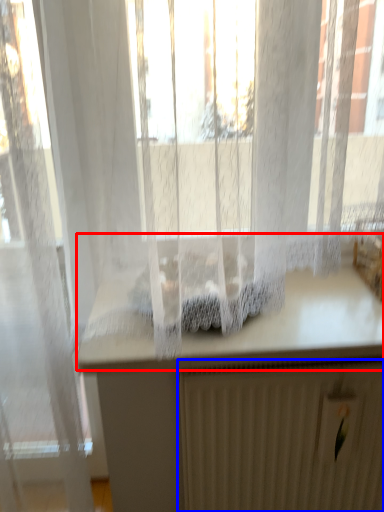
Question: Which object is further to the camera taking this photo, counter top (highlighted by a red box) or radiator (highlighted by a blue box)?

Choices:
 (A) counter top
 (B) radiator

Answer: (B)